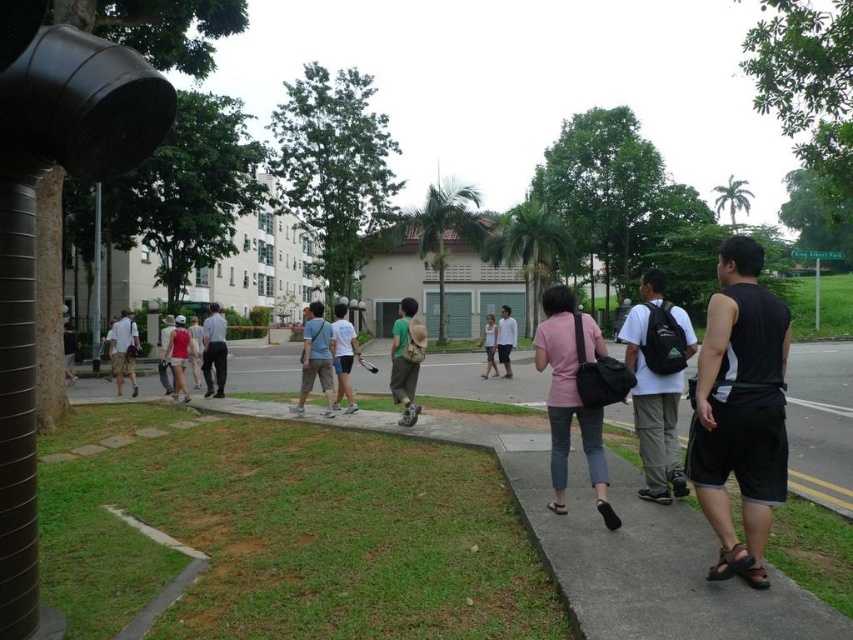
How far apart are black matte backpack at center-right and white cotton shirt at center?

18.19 feet

Is point (643, 380) positioned before point (332, 337)?

That is True.

Locate an element on the screen. black matte backpack at center-right is located at coordinates (x=656, y=392).

Between green fabric backpack at center and white cotton shirt at center, which one has less height?

white cotton shirt at center

Can you confirm if green fabric backpack at center is positioned to the left of white cotton shirt at center?

In fact, green fabric backpack at center is to the right of white cotton shirt at center.

In order to click on green fabric backpack at center in this screenshot , I will do `click(405, 358)`.

Looking at this image, does pink fabric shirt at center have a lesser height compared to light blue shirt at center?

Yes.

Identify the location of pink fabric shirt at center. This screenshot has height=640, width=853. (570, 396).

What do you see at coordinates (570, 396) in the screenshot? I see `pink fabric shirt at center` at bounding box center [570, 396].

Find the location of `pink fabric shirt at center`. pink fabric shirt at center is located at coordinates (570, 396).